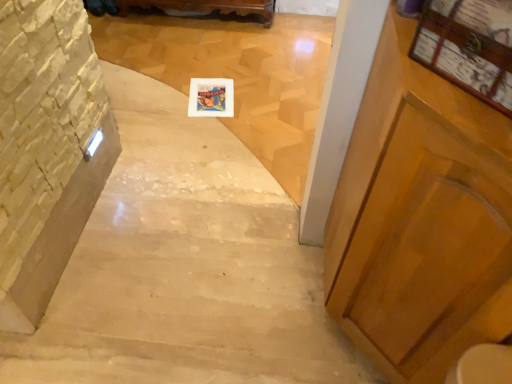
Question: From the image's perspective, does white marble stairs at center, which is the second stairwell in left-to-right order, appear lower than wooden frame at center?

Choices:
 (A) yes
 (B) no

Answer: (A)

Question: Would you consider white marble stairs at center, the 1th stairwell in the right-to-left sequence, to be distant from wooden frame at center?

Choices:
 (A) no
 (B) yes

Answer: (A)

Question: From a real-world perspective, is white marble stairs at center, which is the second stairwell in left-to-right order, physically above wooden frame at center?

Choices:
 (A) no
 (B) yes

Answer: (B)

Question: Would you say wooden frame at center is part of white marble stairs at center, which is the second stairwell in left-to-right order,'s contents?

Choices:
 (A) no
 (B) yes

Answer: (B)

Question: From a real-world perspective, does white marble stairs at center, which is the second stairwell in left-to-right order, sit lower than wooden frame at center?

Choices:
 (A) no
 (B) yes

Answer: (A)

Question: In terms of height, does wooden frame at upper right look taller or shorter compared to wooden frame at center?

Choices:
 (A) tall
 (B) short

Answer: (A)

Question: Relative to wooden frame at center, is wooden frame at upper right in front or behind?

Choices:
 (A) behind
 (B) front

Answer: (B)

Question: Based on their positions, is wooden frame at upper right located to the left or right of wooden frame at center?

Choices:
 (A) left
 (B) right

Answer: (B)

Question: From a real-world perspective, is wooden frame at upper right positioned above or below wooden frame at center?

Choices:
 (A) below
 (B) above

Answer: (B)

Question: Is stone textured wall at left, positioned as the first stairwell in left-to-right order, in front of or behind wooden frame at upper right in the image?

Choices:
 (A) front
 (B) behind

Answer: (B)

Question: Is stone textured wall at left, positioned as the first stairwell in left-to-right order, inside the boundaries of wooden frame at upper right, or outside?

Choices:
 (A) outside
 (B) inside

Answer: (A)

Question: Is stone textured wall at left, the 2th stairwell from the right, bigger or smaller than wooden frame at upper right?

Choices:
 (A) small
 (B) big

Answer: (A)

Question: From a real-world perspective, is stone textured wall at left, the 2th stairwell from the right, positioned above or below wooden frame at upper right?

Choices:
 (A) above
 (B) below

Answer: (B)

Question: Would you say wooden carved bench at upper center is to the left or to the right of wooden frame at upper right in the picture?

Choices:
 (A) right
 (B) left

Answer: (B)

Question: Is wooden carved bench at upper center bigger or smaller than wooden frame at upper right?

Choices:
 (A) small
 (B) big

Answer: (B)